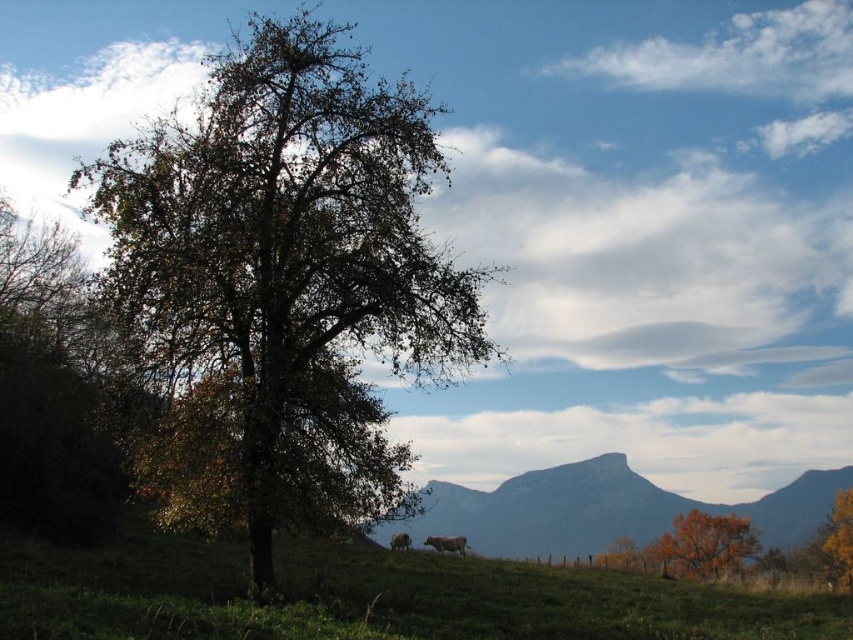
Based on the scene description, where is the green leafy tree at center located in terms of coordinates?

The green leafy tree at center is located at coordinates point (x=283, y=285).

You are a hiker who wants to place a 1.2 meter wide tent between the smooth gray rock at center and the orange leafy tree at lower right. Can you fit the tent there?

The smooth gray rock at center might be wider than orange leafy tree at lower right. Since the distance between them is uncertain, it is possible the space could accommodate the 1.2 meter wide tent, but there is some uncertainty due to the width comparison between the rock and tree.

You are a hiker standing at the edge of the field looking towards the green leafy tree at center and the smooth gray rock at center. Which object is taller?

The green leafy tree at center is taller than the smooth gray rock at center.